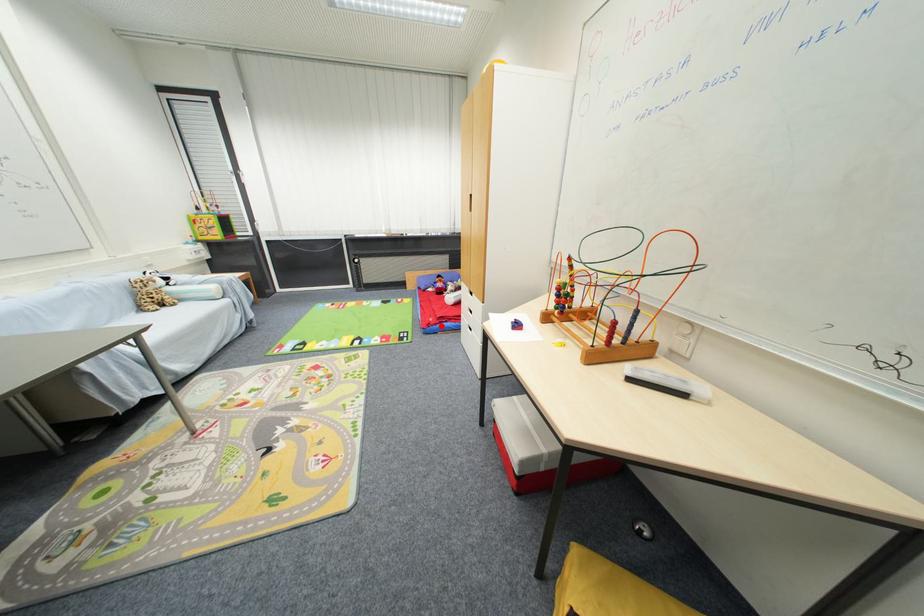
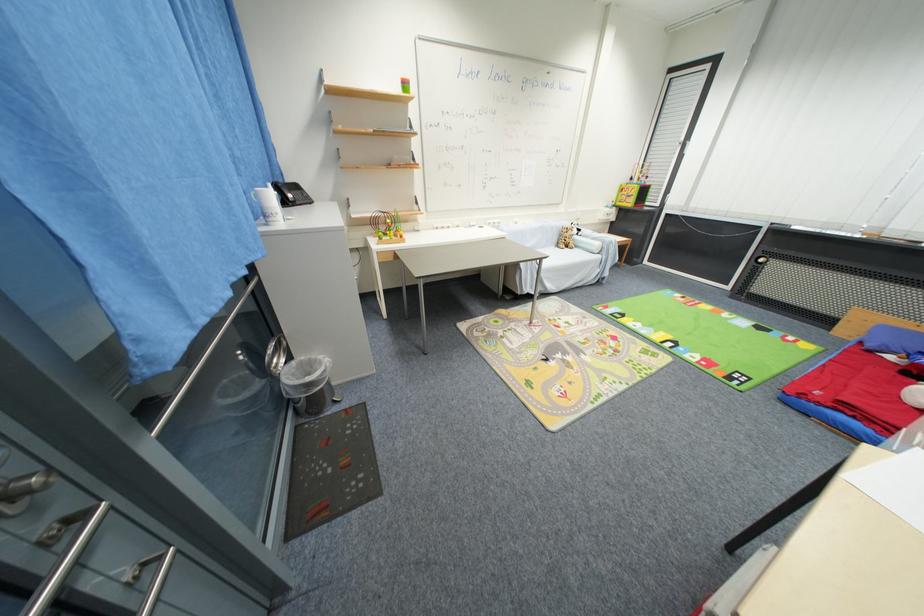
The point at the highlighted location is marked in the first image. Where is the corresponding point in the second image?

(824, 406)